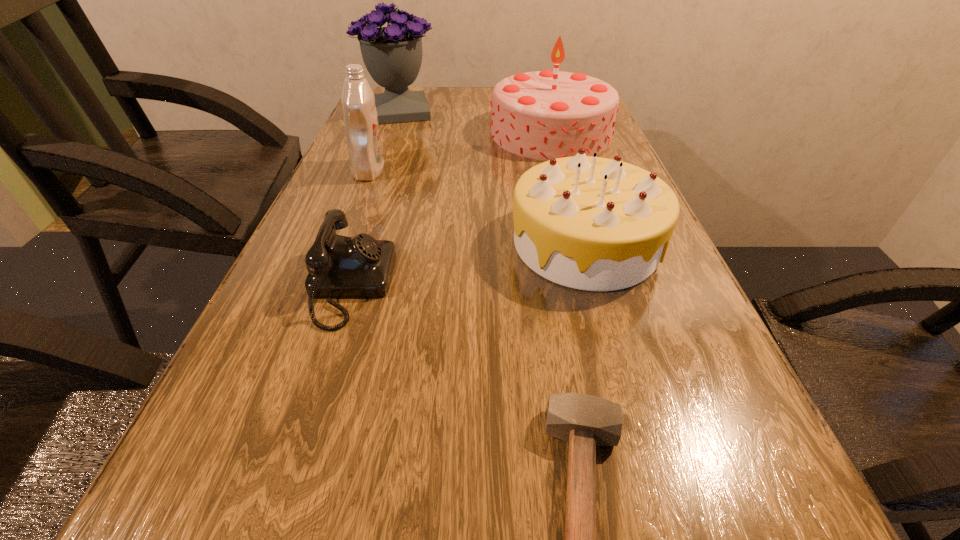
Identify the location of vacant space located on the dial of the telephone. (593, 285).

What are the coordinates of `bouquet that is at the far edge` in the screenshot? It's located at (392, 55).

The height and width of the screenshot is (540, 960). I want to click on birthday cake present at the far edge, so click(542, 115).

Find the location of a particular element. This screenshot has width=960, height=540. bouquet located at the left edge is located at coordinates (392, 55).

Identify the location of detergent that is at the left edge. The width and height of the screenshot is (960, 540). click(361, 124).

Find the location of a particular element. The height and width of the screenshot is (540, 960). telephone located at the left edge is located at coordinates (340, 267).

Identify the location of object present at the far left corner. The height and width of the screenshot is (540, 960). (392, 55).

This screenshot has width=960, height=540. What are the coordinates of `object that is at the far right corner` in the screenshot? It's located at (542, 115).

Locate an element on the screen. vacant space at the left edge is located at coordinates (196, 422).

What are the coordinates of `vacant area at the right edge of the desktop` in the screenshot? It's located at (798, 513).